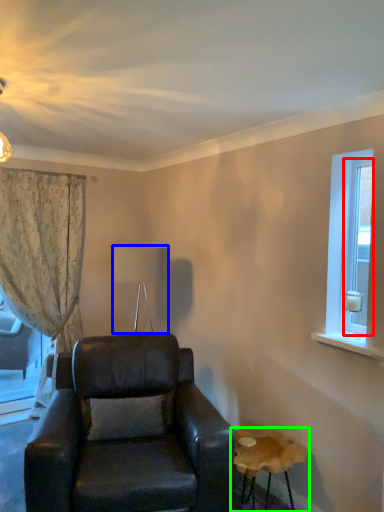
Question: Which is nearer to the glass door (highlighted by a red box)? lamp (highlighted by a blue box) or table (highlighted by a green box).

Choices:
 (A) lamp
 (B) table

Answer: (B)